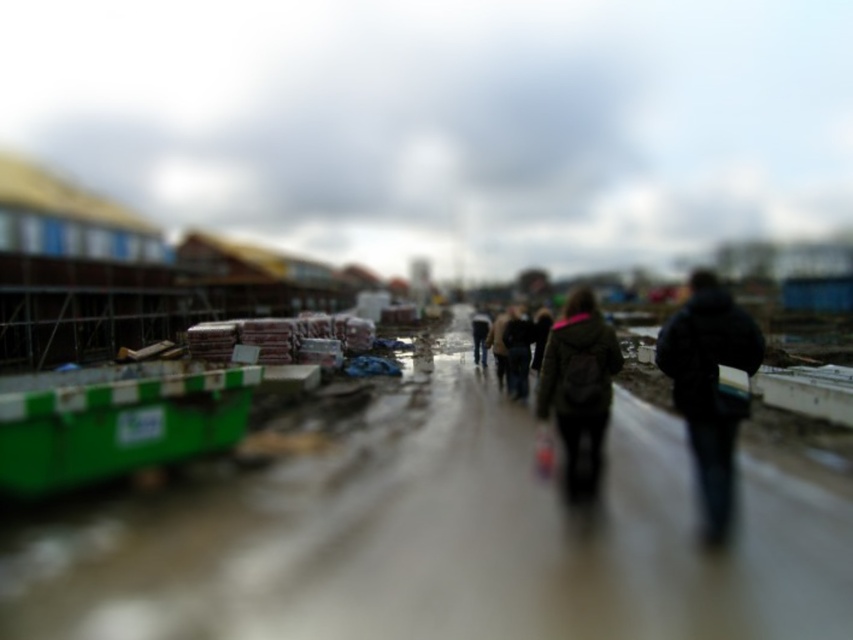
You are a delivery person trying to navigate through the construction site. You see a black matte jacket at right and a dark green jacket at center. Which jacket is nearer to you as you approach the site?

The black matte jacket at right is closer to the viewer than the dark green jacket at center, so the black matte jacket at right is nearer.

You are a delivery person arriving at this construction site. You need to unload the green plastic containers at left and the black matte jacket at right. Based on their positions, which object should you unload first to avoid blocking the path for the other?

The green plastic containers at left should be unloaded first because they are positioned to the left of the black matte jacket at right, so unloading them first would prevent blocking the path to the jacket.